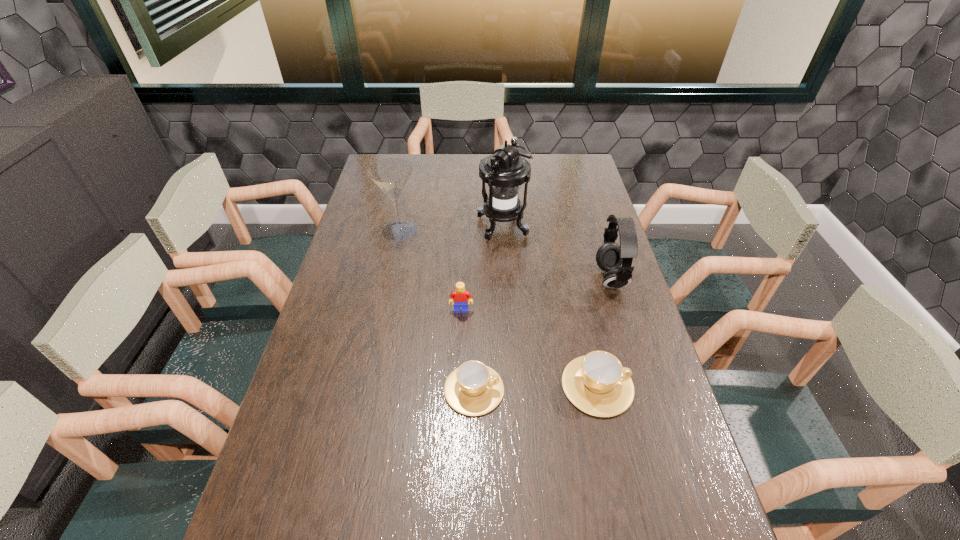
Find the location of `blank area located 0.070m with the handle on the side of the taller cup`. blank area located 0.070m with the handle on the side of the taller cup is located at coordinates (660, 386).

Locate an element on the screen. free location located on the right of the leftmost object is located at coordinates (482, 231).

At what (x,y) coordinates should I click in order to perform the action: click on free space located on the back of the tallest object. Please return your answer as a coordinate pair (x, y). Looking at the image, I should click on (501, 198).

The width and height of the screenshot is (960, 540). I want to click on free space located 0.250m on the ear cups of the earphone, so click(x=517, y=279).

Identify the location of free location located 0.100m on the ear cups of the earphone. pyautogui.click(x=564, y=279).

The width and height of the screenshot is (960, 540). In order to click on free space located 0.150m on the ear cups of the earphone in this screenshot , I will do `click(549, 279)`.

Identify the location of vacant space located on the face of the Lego. Image resolution: width=960 pixels, height=540 pixels. (461, 329).

I want to click on object that is at the left edge, so click(x=391, y=175).

Locate an element on the screen. cup at the right edge is located at coordinates (597, 384).

At what (x,y) coordinates should I click in order to perform the action: click on earphone that is at the right edge. Please return your answer as a coordinate pair (x, y). This screenshot has width=960, height=540. Looking at the image, I should click on (610, 256).